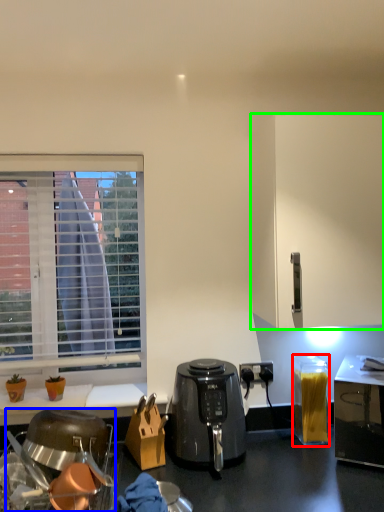
Question: Which object is the closest to the appliance (highlighted by a red box)? Choose among these: kitchen appliance (highlighted by a blue box) or cabinetry (highlighted by a green box).

Choices:
 (A) kitchen appliance
 (B) cabinetry

Answer: (B)